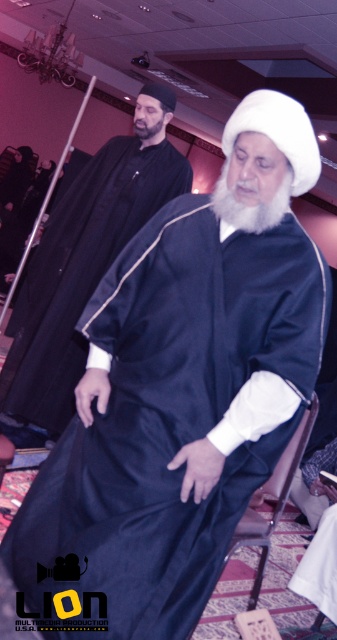
Question: Which of these objects is positioned closest to the satin black robe at center?

Choices:
 (A) matte black robe at center
 (B) brown leather chair at lower center
 (C) white soft beard at center

Answer: (B)

Question: Which object appears closest to the camera in this image?

Choices:
 (A) matte black robe at center
 (B) satin black robe at center

Answer: (B)

Question: Which point is farther to the camera?

Choices:
 (A) satin black robe at center
 (B) matte black robe at center
 (C) white soft beard at center

Answer: (B)

Question: Observing the image, what is the correct spatial positioning of matte black robe at center in reference to brown leather chair at lower center?

Choices:
 (A) below
 (B) above

Answer: (B)

Question: Does brown leather chair at lower center have a lesser width compared to gray matte beard at upper center?

Choices:
 (A) no
 (B) yes

Answer: (A)

Question: Observing the image, what is the correct spatial positioning of satin black robe at center in reference to white soft beard at center?

Choices:
 (A) left
 (B) right

Answer: (A)